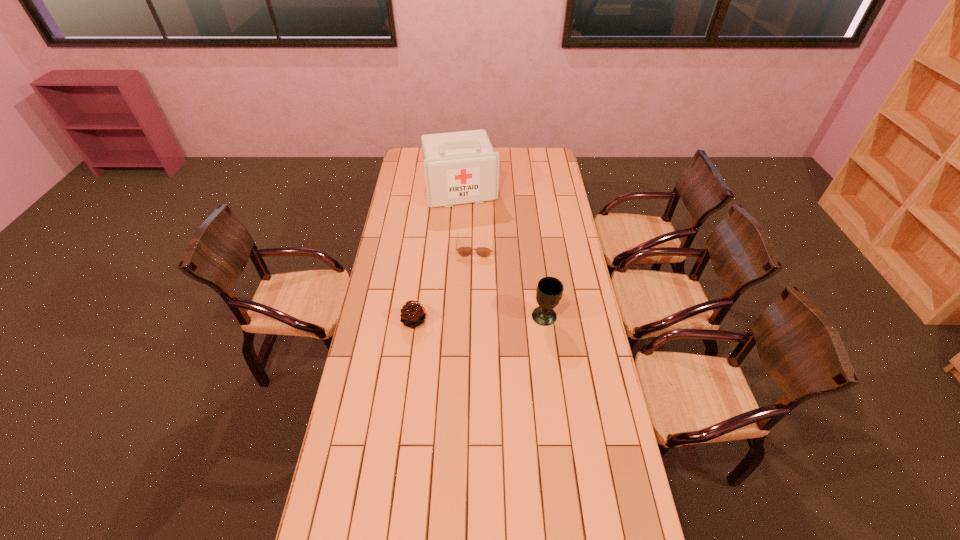
This screenshot has height=540, width=960. Find the location of `vacant space on the desktop that is between the pinecone and the rightmost object and is positioned on the front-facing side of the tallest object`. vacant space on the desktop that is between the pinecone and the rightmost object and is positioned on the front-facing side of the tallest object is located at coordinates (497, 318).

Locate an element on the screen. This screenshot has width=960, height=540. free spot on the desktop that is between the second shortest object and the rightmost object and is positioned on the front-facing side of the shortest object is located at coordinates (468, 319).